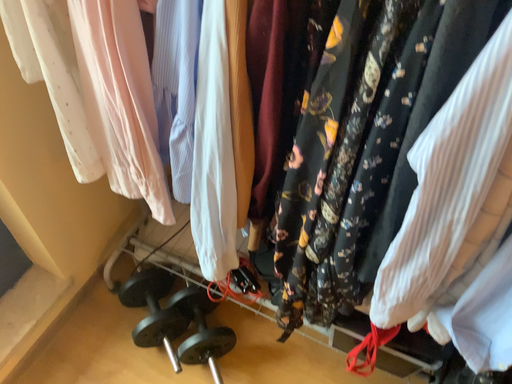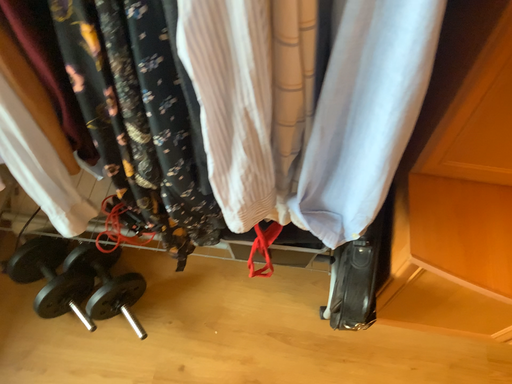
Question: Which way did the camera rotate in the video?

Choices:
 (A) rotated left
 (B) rotated right

Answer: (B)